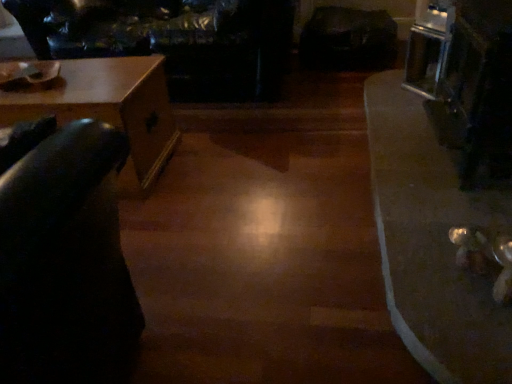
Locate an element on the screen. empty space that is ontop of wooden table at left, which is the second table from right to left (from a real-world perspective) is located at coordinates (80, 80).